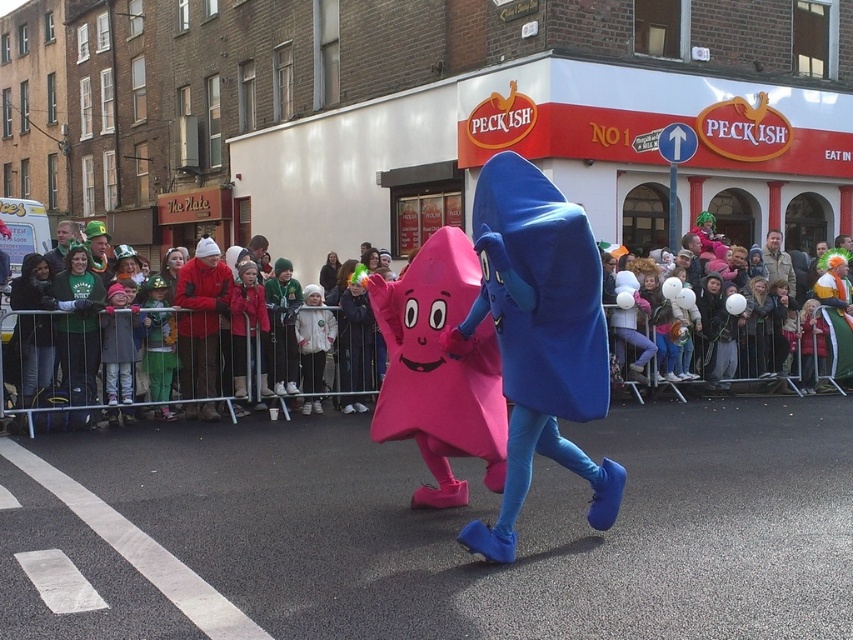
You are standing on the street and see the blue fabric costume at center. If you want to move closer to it, in which direction should you walk relative to your current position?

The blue fabric costume at center is located at coordinates 0.527 on the x axis and 0.632 on the y axis. To move closer to it, you should walk towards the direction where the x coordinate increases and the y coordinate increases.

What are the coordinates of the blue fabric costume at center in the image?

The coordinates of the blue fabric costume at center are at point (538, 337).